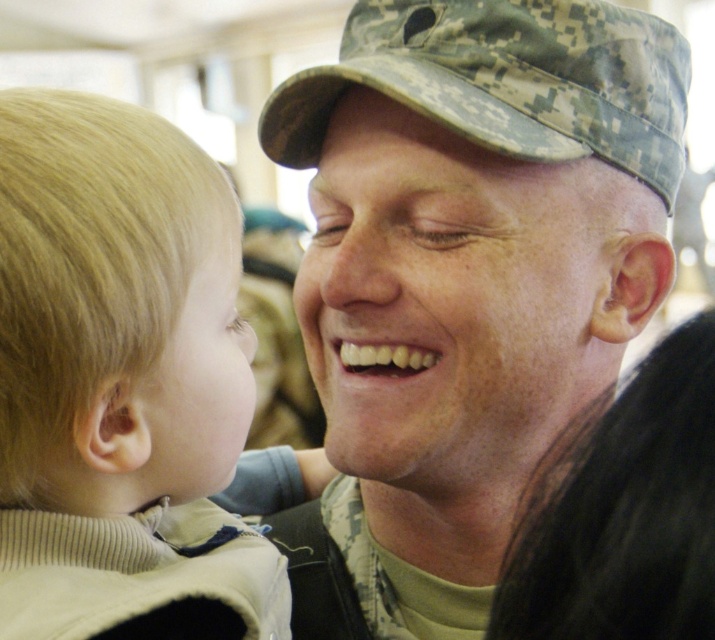
Is matte camouflage face at center taller than pale skin/smooth face at left?

Correct, matte camouflage face at center is much taller as pale skin/smooth face at left.

Can you confirm if matte camouflage face at center is positioned to the left of pale skin/smooth face at left?

In fact, matte camouflage face at center is to the right of pale skin/smooth face at left.

Image resolution: width=715 pixels, height=640 pixels. What are the coordinates of `matte camouflage face at center` in the screenshot? It's located at (448, 300).

Measure the distance from blonde hair at left to pale skin/smooth face at left.

blonde hair at left is 1.11 inches away from pale skin/smooth face at left.

Is point (220, 400) in front of point (187, 324)?

No.

You are a GUI agent. You are given a task and a screenshot of the screen. Output one action in this format:
    pyautogui.click(x=<x>, y=<y>)
    Task: Click on the blonde hair at left
    The width and height of the screenshot is (715, 640).
    Given the screenshot: What is the action you would take?
    pyautogui.click(x=122, y=381)

Can you confirm if camouflage uniform at center is bigger than matte camouflage face at center?

Yes, camouflage uniform at center is bigger than matte camouflage face at center.

Measure the distance from camouflage uniform at center to matte camouflage face at center.

A distance of 0.81 inches exists between camouflage uniform at center and matte camouflage face at center.

Which is in front, point (368, 26) or point (418, 392)?

Positioned in front is point (418, 392).

You are a GUI agent. You are given a task and a screenshot of the screen. Output one action in this format:
    pyautogui.click(x=<x>, y=<y>)
    Task: Click on the camouflage uniform at center
    Image resolution: width=715 pixels, height=640 pixels.
    Given the screenshot: What is the action you would take?
    pyautogui.click(x=470, y=268)